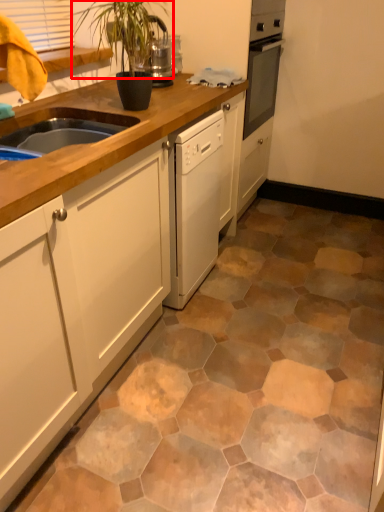
Question: Observing the image, what is the correct spatial positioning of plant (annotated by the red box) in reference to cabinetry?

Choices:
 (A) right
 (B) left

Answer: (A)